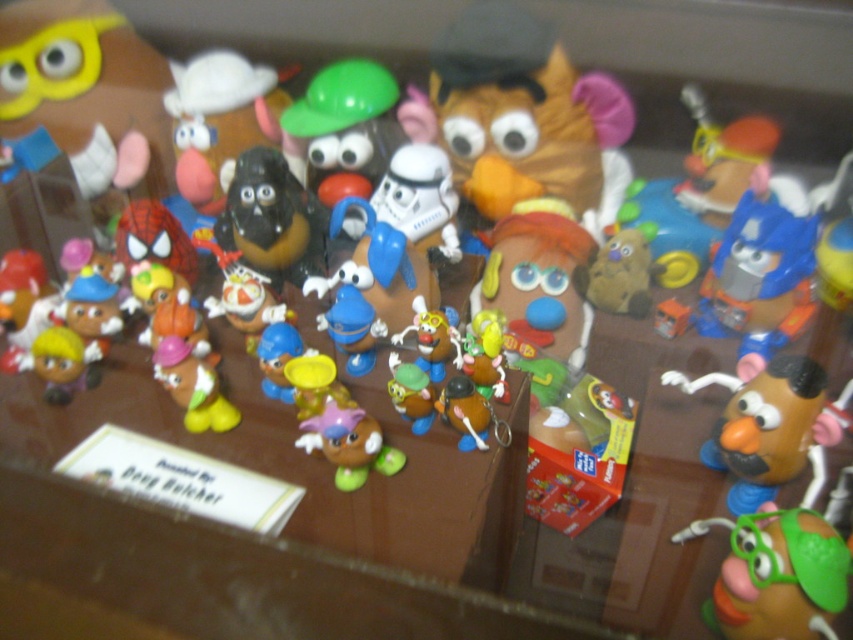
Is point (431, 93) closer to viewer compared to point (358, 321)?

No.

Is brown matte potato at center positioned at the back of blue plastic toy at center?

That is True.

At what (x,y) coordinates should I click in order to perform the action: click on brown matte potato at center. Please return your answer as a coordinate pair (x, y). This screenshot has height=640, width=853. Looking at the image, I should click on (524, 115).

The image size is (853, 640). Identify the location of brown matte potato at center. (524, 115).

Does green rubber potato at lower right lie in front of matte yellow potato at center?

Yes.

Between green rubber potato at lower right and matte yellow potato at center, which one is positioned higher?

Positioned higher is matte yellow potato at center.

Is point (775, 572) in front of point (206, 364)?

Yes, point (775, 572) is closer to viewer.

You are a GUI agent. You are given a task and a screenshot of the screen. Output one action in this format:
    pyautogui.click(x=<x>, y=<y>)
    Task: Click on the green rubber potato at lower right
    This screenshot has height=640, width=853.
    Given the screenshot: What is the action you would take?
    pyautogui.click(x=776, y=573)

Which is below, matte black figure at upper center or matte purple potato at center?

matte purple potato at center is below.

How much distance is there between matte black figure at upper center and matte purple potato at center?

matte black figure at upper center is 20.20 inches away from matte purple potato at center.

Is point (247, 68) positioned before point (376, 458)?

No, (247, 68) is further to viewer.

In order to click on matte black figure at upper center in this screenshot , I will do `click(219, 122)`.